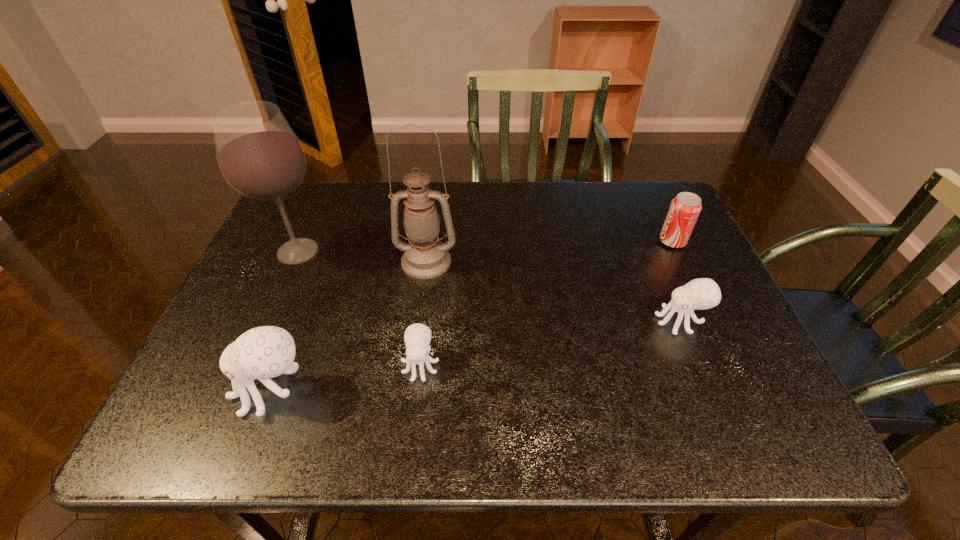
Find the location of a particular element. the fourth shortest object is located at coordinates (264, 352).

This screenshot has height=540, width=960. Find the location of `the tallest octopus`. the tallest octopus is located at coordinates (264, 352).

Locate an element on the screen. the second octopus from right to left is located at coordinates (417, 337).

You are a GUI agent. You are given a task and a screenshot of the screen. Output one action in this format:
    pyautogui.click(x=<x>, y=<y>)
    Task: Click on the shortest object
    
    Given the screenshot: What is the action you would take?
    pyautogui.click(x=417, y=337)

At what (x,y) coordinates should I click in order to perform the action: click on the farthest octopus. Please return your answer as a coordinate pair (x, y). Looking at the image, I should click on click(703, 293).

Identify the location of the third nearest object. (703, 293).

Identify the location of oil lamp. This screenshot has height=540, width=960. (425, 257).

Locate an element on the screen. This screenshot has height=540, width=960. soda can is located at coordinates (684, 210).

Identify the location of alcohol. This screenshot has width=960, height=540. 259,155.

Find the location of a particular element. This screenshot has height=540, width=960. vacant space positioned 0.070m on the front-facing side of the tallest octopus is located at coordinates (198, 390).